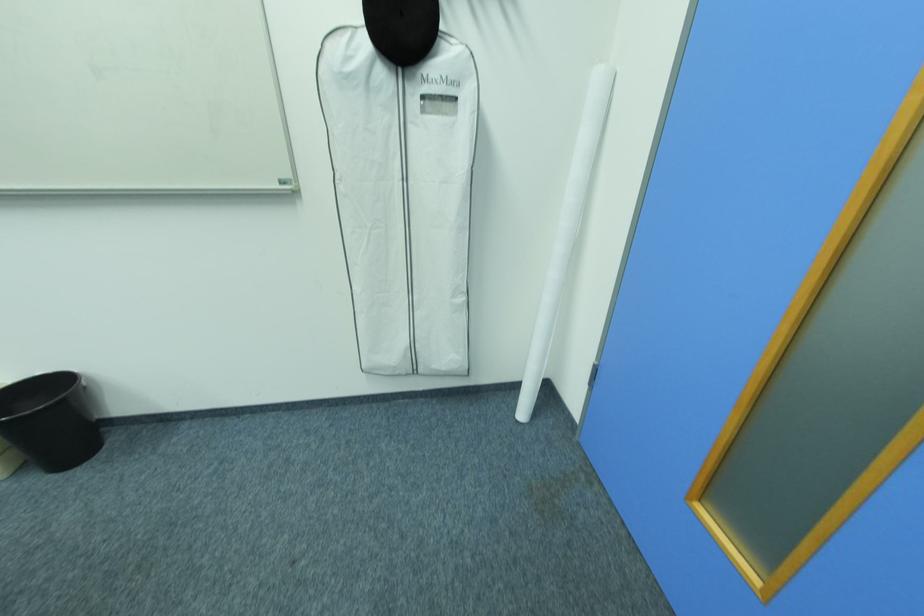
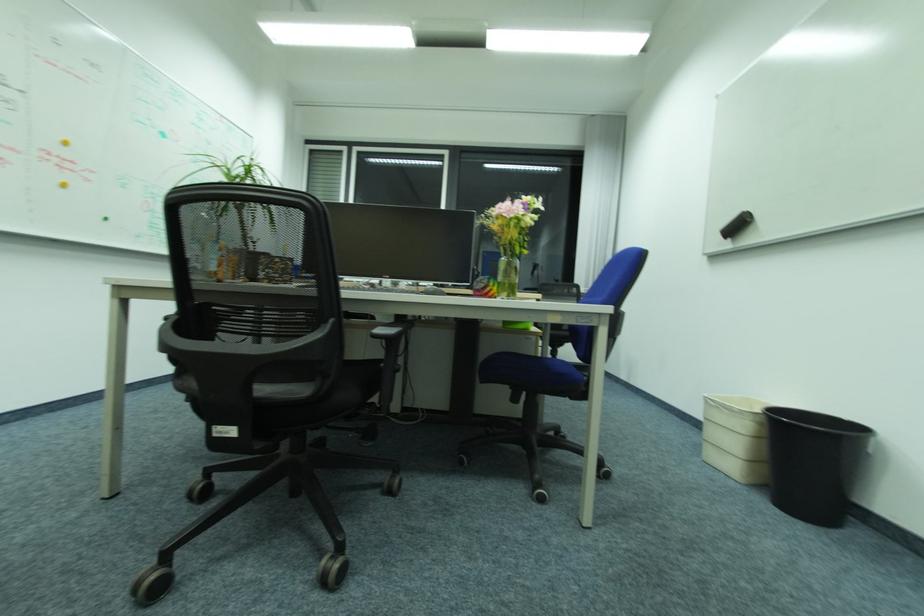
Question: The camera is either moving clockwise (left) or counter-clockwise (right) around the object. The first image is from the beginning of the video and the second image is from the end. Is the camera moving left or right when shooting the video?

Choices:
 (A) Left
 (B) Right

Answer: (B)